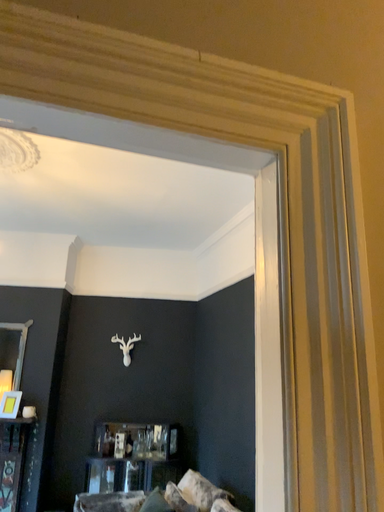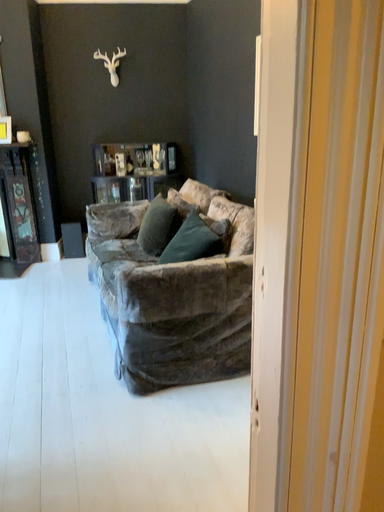
Question: How did the camera likely rotate when shooting the video?

Choices:
 (A) rotated upward
 (B) rotated downward

Answer: (B)